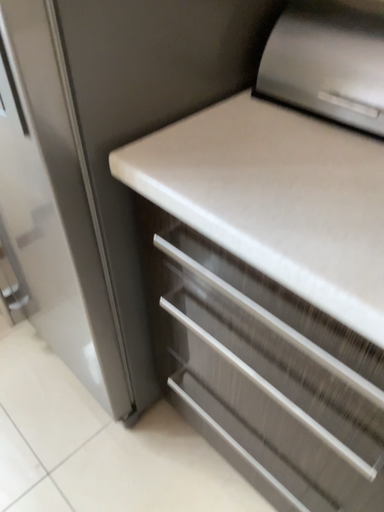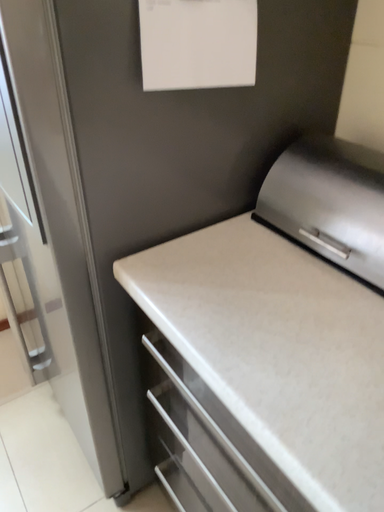
Question: Which way did the camera rotate in the video?

Choices:
 (A) rotated left
 (B) rotated right

Answer: (A)